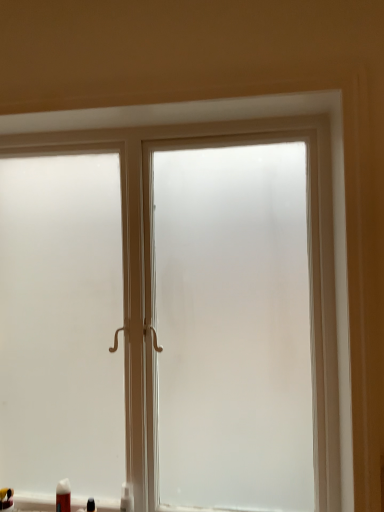
The width and height of the screenshot is (384, 512). Identify the location of white matte tube at lower left, positioned as the 3th toiletry in right-to-left order. (63, 496).

Find the location of a particular element. Image resolution: width=384 pixels, height=512 pixels. white plastic bottle at lower left, acting as the 1th toiletry starting from the right is located at coordinates (127, 498).

The image size is (384, 512). In order to click on white matte tube at lower left, acting as the 2th toiletry starting from the left in this screenshot , I will do `click(63, 496)`.

Between frosted glass window at center and white matte tube at lower left, positioned as the 3th toiletry in right-to-left order, which one has larger width?

With larger width is frosted glass window at center.

Is point (210, 136) positioned before point (70, 490)?

Yes, it is in front of point (70, 490).

From the frosted glass window at center, count 3rd toiletrys backward and point to it. Please provide its 2D coordinates.

[(63, 496)]

Is point (12, 505) farther from camera compared to point (88, 507)?

Yes, point (12, 505) is farther from viewer.

Considering their positions, is matte black toothpaste tube at lower left, which is the fourth toiletry from right to left, located in front of or behind matte black bottle at lower left, the 3th toiletry positioned from the left?

matte black toothpaste tube at lower left, which is the fourth toiletry from right to left, is positioned farther from the viewer than matte black bottle at lower left, the 3th toiletry positioned from the left.

Is matte black toothpaste tube at lower left, which is the fourth toiletry from right to left, next to matte black bottle at lower left, which ranks as the 2th toiletry in right-to-left order, and touching it?

→ No, matte black toothpaste tube at lower left, which is the fourth toiletry from right to left, is not in contact with matte black bottle at lower left, which ranks as the 2th toiletry in right-to-left order.

Looking at the image, does matte black toothpaste tube at lower left, the first toiletry in the left-to-right sequence, seem bigger or smaller compared to matte black bottle at lower left, which ranks as the 2th toiletry in right-to-left order?

In the image, matte black toothpaste tube at lower left, the first toiletry in the left-to-right sequence, appears to be larger than matte black bottle at lower left, which ranks as the 2th toiletry in right-to-left order.

Based on the photo, from a real-world perspective, is white plastic bottle at lower left, which is counted as the fourth toiletry, starting from the left, positioned above or below frosted glass window at center?

Clearly, from a real-world perspective, white plastic bottle at lower left, which is counted as the fourth toiletry, starting from the left, is below frosted glass window at center.

Is white plastic bottle at lower left, which is counted as the fourth toiletry, starting from the left, positioned before frosted glass window at center?

No, the depth of white plastic bottle at lower left, which is counted as the fourth toiletry, starting from the left, is greater than that of frosted glass window at center.

Is white plastic bottle at lower left, acting as the 1th toiletry starting from the right, thinner than frosted glass window at center?

Correct, the width of white plastic bottle at lower left, acting as the 1th toiletry starting from the right, is less than that of frosted glass window at center.

Which is correct: white plastic bottle at lower left, which is counted as the fourth toiletry, starting from the left, is inside frosted glass window at center, or outside of it?

white plastic bottle at lower left, which is counted as the fourth toiletry, starting from the left, lies within the bounds of frosted glass window at center.

Between white plastic bottle at lower left, which is counted as the fourth toiletry, starting from the left, and matte black bottle at lower left, which ranks as the 2th toiletry in right-to-left order, which one has more height?

white plastic bottle at lower left, which is counted as the fourth toiletry, starting from the left.

From the image's perspective, is white plastic bottle at lower left, which is counted as the fourth toiletry, starting from the left, under matte black bottle at lower left, the 3th toiletry positioned from the left?

No, from the image's perspective, white plastic bottle at lower left, which is counted as the fourth toiletry, starting from the left, is not beneath matte black bottle at lower left, the 3th toiletry positioned from the left.

In the scene shown: Is white plastic bottle at lower left, acting as the 1th toiletry starting from the right, not near matte black bottle at lower left, which ranks as the 2th toiletry in right-to-left order?

white plastic bottle at lower left, acting as the 1th toiletry starting from the right, is near matte black bottle at lower left, which ranks as the 2th toiletry in right-to-left order, not far away.

Is the surface of matte black toothpaste tube at lower left, which is the fourth toiletry from right to left, in direct contact with frosted glass window at center?

matte black toothpaste tube at lower left, which is the fourth toiletry from right to left, and frosted glass window at center are clearly separated.

How much distance is there between matte black toothpaste tube at lower left, the first toiletry in the left-to-right sequence, and frosted glass window at center?

matte black toothpaste tube at lower left, the first toiletry in the left-to-right sequence, is 1.04 meters away from frosted glass window at center.

From the image's perspective, which object appears higher, matte black toothpaste tube at lower left, the first toiletry in the left-to-right sequence, or frosted glass window at center?

From the image's view, frosted glass window at center is above.

Considering their positions, is matte black toothpaste tube at lower left, the first toiletry in the left-to-right sequence, located in front of or behind frosted glass window at center?

Clearly, matte black toothpaste tube at lower left, the first toiletry in the left-to-right sequence, is behind frosted glass window at center.

Can you confirm if matte black toothpaste tube at lower left, the first toiletry in the left-to-right sequence, is wider than white plastic bottle at lower left, which is counted as the fourth toiletry, starting from the left?

Indeed, matte black toothpaste tube at lower left, the first toiletry in the left-to-right sequence, has a greater width compared to white plastic bottle at lower left, which is counted as the fourth toiletry, starting from the left.

Which object is more forward, matte black toothpaste tube at lower left, the first toiletry in the left-to-right sequence, or white plastic bottle at lower left, acting as the 1th toiletry starting from the right?

white plastic bottle at lower left, acting as the 1th toiletry starting from the right, is in front.

Looking at the image, does matte black toothpaste tube at lower left, the first toiletry in the left-to-right sequence, seem bigger or smaller compared to white plastic bottle at lower left, acting as the 1th toiletry starting from the right?

matte black toothpaste tube at lower left, the first toiletry in the left-to-right sequence, is bigger than white plastic bottle at lower left, acting as the 1th toiletry starting from the right.

Are matte black toothpaste tube at lower left, which is the fourth toiletry from right to left, and white plastic bottle at lower left, acting as the 1th toiletry starting from the right, beside each other?

No, matte black toothpaste tube at lower left, which is the fourth toiletry from right to left, is not in contact with white plastic bottle at lower left, acting as the 1th toiletry starting from the right.

Between matte black bottle at lower left, which ranks as the 2th toiletry in right-to-left order, and matte black toothpaste tube at lower left, which is the fourth toiletry from right to left, which one has more height?

With more height is matte black bottle at lower left, which ranks as the 2th toiletry in right-to-left order.

Consider the image. From a real-world perspective, is matte black bottle at lower left, the 3th toiletry positioned from the left, positioned above or below matte black toothpaste tube at lower left, the first toiletry in the left-to-right sequence?

In terms of real-world spatial position, matte black bottle at lower left, the 3th toiletry positioned from the left, is below matte black toothpaste tube at lower left, the first toiletry in the left-to-right sequence.

Based on the photo, from the image's perspective, is matte black bottle at lower left, which ranks as the 2th toiletry in right-to-left order, above matte black toothpaste tube at lower left, the first toiletry in the left-to-right sequence?

Yes, from the image's perspective, matte black bottle at lower left, which ranks as the 2th toiletry in right-to-left order, is above matte black toothpaste tube at lower left, the first toiletry in the left-to-right sequence.

From a real-world perspective, count 1st toiletrys downward from the frosted glass window at center and point to it. Please provide its 2D coordinates.

[(63, 496)]

From the image's perspective, which toiletry is the 1st one above the matte black toothpaste tube at lower left, the first toiletry in the left-to-right sequence? Please provide its 2D coordinates.

[(91, 505)]

Which object lies further to the anchor point matte black toothpaste tube at lower left, the first toiletry in the left-to-right sequence, white matte tube at lower left, acting as the 2th toiletry starting from the left, or white plastic bottle at lower left, acting as the 1th toiletry starting from the right?

white plastic bottle at lower left, acting as the 1th toiletry starting from the right, lies further to matte black toothpaste tube at lower left, the first toiletry in the left-to-right sequence, than the other object.

From the image, which object appears to be farther from frosted glass window at center, white plastic bottle at lower left, which is counted as the fourth toiletry, starting from the left, or matte black toothpaste tube at lower left, the first toiletry in the left-to-right sequence?

matte black toothpaste tube at lower left, the first toiletry in the left-to-right sequence, is positioned further to the anchor frosted glass window at center.

Looking at the image, which one is located further to white plastic bottle at lower left, which is counted as the fourth toiletry, starting from the left, matte black toothpaste tube at lower left, the first toiletry in the left-to-right sequence, or white matte tube at lower left, positioned as the 3th toiletry in right-to-left order?

matte black toothpaste tube at lower left, the first toiletry in the left-to-right sequence, is further to white plastic bottle at lower left, which is counted as the fourth toiletry, starting from the left.

Consider the image. Considering their positions, is matte black bottle at lower left, which ranks as the 2th toiletry in right-to-left order, positioned further to matte black toothpaste tube at lower left, which is the fourth toiletry from right to left, than frosted glass window at center?

Among the two, frosted glass window at center is located further to matte black toothpaste tube at lower left, which is the fourth toiletry from right to left.

Estimate the real-world distances between objects in this image. Which object is further from frosted glass window at center, matte black bottle at lower left, which ranks as the 2th toiletry in right-to-left order, or white plastic bottle at lower left, acting as the 1th toiletry starting from the right?

matte black bottle at lower left, which ranks as the 2th toiletry in right-to-left order, is positioned further to the anchor frosted glass window at center.

Based on their spatial positions, is frosted glass window at center or white matte tube at lower left, acting as the 2th toiletry starting from the left, further from white plastic bottle at lower left, which is counted as the fourth toiletry, starting from the left?

frosted glass window at center.

Estimate the real-world distances between objects in this image. Which object is further from matte black bottle at lower left, the 3th toiletry positioned from the left, white matte tube at lower left, positioned as the 3th toiletry in right-to-left order, or white plastic bottle at lower left, which is counted as the fourth toiletry, starting from the left?

Based on the image, white plastic bottle at lower left, which is counted as the fourth toiletry, starting from the left, appears to be further to matte black bottle at lower left, the 3th toiletry positioned from the left.

Looking at this image, from the image, which object appears to be nearer to frosted glass window at center, white matte tube at lower left, acting as the 2th toiletry starting from the left, or white plastic bottle at lower left, which is counted as the fourth toiletry, starting from the left?

white plastic bottle at lower left, which is counted as the fourth toiletry, starting from the left, lies closer to frosted glass window at center than the other object.

Find the location of a particular element. The width and height of the screenshot is (384, 512). toiletry between frosted glass window at center and white plastic bottle at lower left, acting as the 1th toiletry starting from the right, from top to bottom is located at coordinates (63, 496).

Find the location of `toiletry between matte black toothpaste tube at lower left, which is the fourth toiletry from right to left, and matte black bottle at lower left, which ranks as the 2th toiletry in right-to-left order, in the horizontal direction`. toiletry between matte black toothpaste tube at lower left, which is the fourth toiletry from right to left, and matte black bottle at lower left, which ranks as the 2th toiletry in right-to-left order, in the horizontal direction is located at coordinates (63, 496).

Image resolution: width=384 pixels, height=512 pixels. I want to click on toiletry situated between white matte tube at lower left, positioned as the 3th toiletry in right-to-left order, and white plastic bottle at lower left, acting as the 1th toiletry starting from the right, from left to right, so click(x=91, y=505).